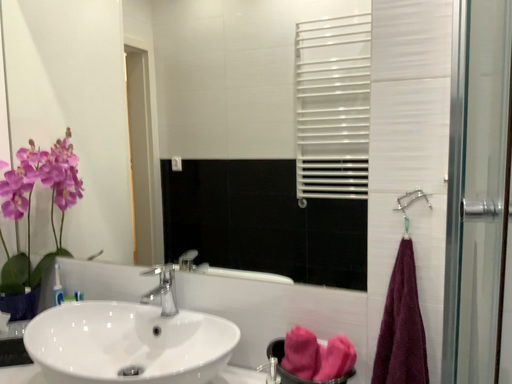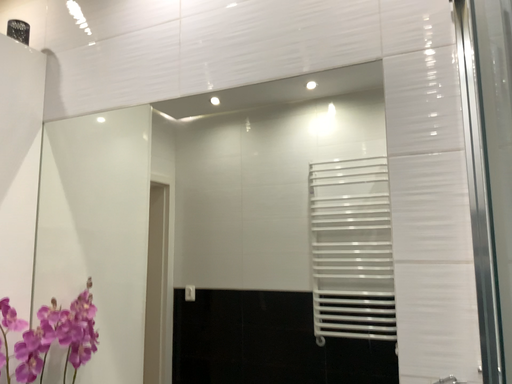
Question: Which way did the camera rotate in the video?

Choices:
 (A) rotated upward
 (B) rotated downward

Answer: (A)